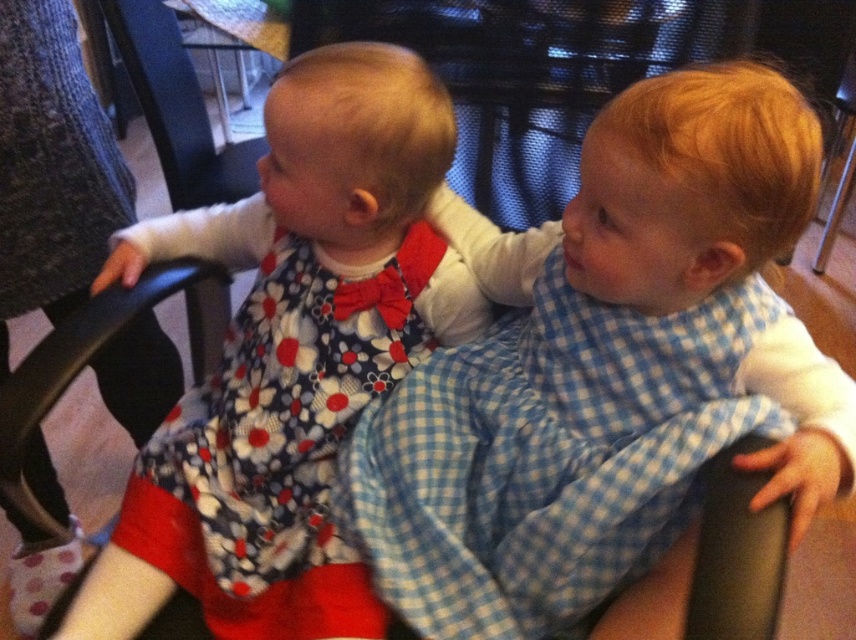
You are a parent trying to determine if your child is wearing the blue checkered bib at center over their floral fabric dress at left. Based on the image, can you confirm if the bib is properly placed over the dress?

The blue checkered bib at center is above the floral fabric dress at left, so yes, the bib is properly placed over the dress.

You are a parent trying to decide which item to use for a photoshoot setup. You have the blue checkered bib at center and the floral fabric dress at left. Which item is shorter in height?

The blue checkered bib at center has a lesser height compared to the floral fabric dress at left, so the blue checkered bib at center is shorter in height.

You are a photographer trying to capture a closeup of the blue checkered bib at center and the floral fabric dress at left. Which object should you focus on first if you want to ensure both are in focus?

The blue checkered bib at center is closer to the viewer than the floral fabric dress at left, so you should focus on the blue checkered bib at center first to ensure both are in focus.